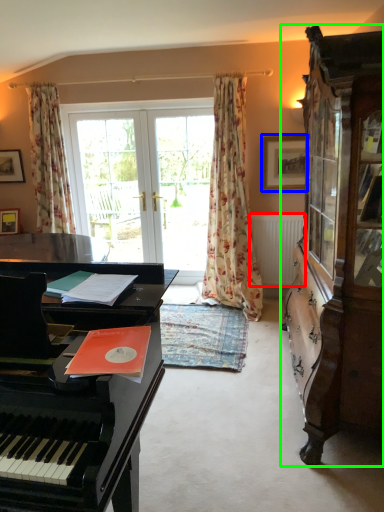
Question: Which object is the farthest from radiator (highlighted by a red box)? Choose among these: picture frame (highlighted by a blue box) or cabinetry (highlighted by a green box).

Choices:
 (A) picture frame
 (B) cabinetry

Answer: (B)